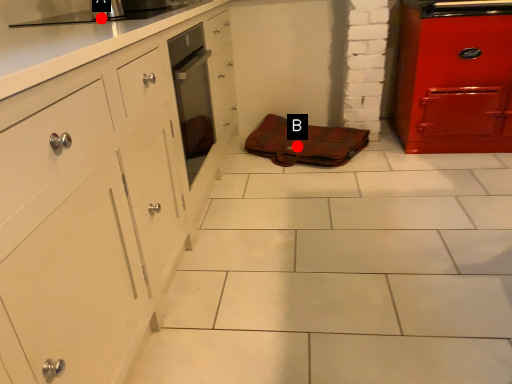
Question: Two points are circled on the image, labeled by A and B beside each circle. Which of the following is the closest to the observer?

Choices:
 (A) A is closer
 (B) B is closer

Answer: (A)